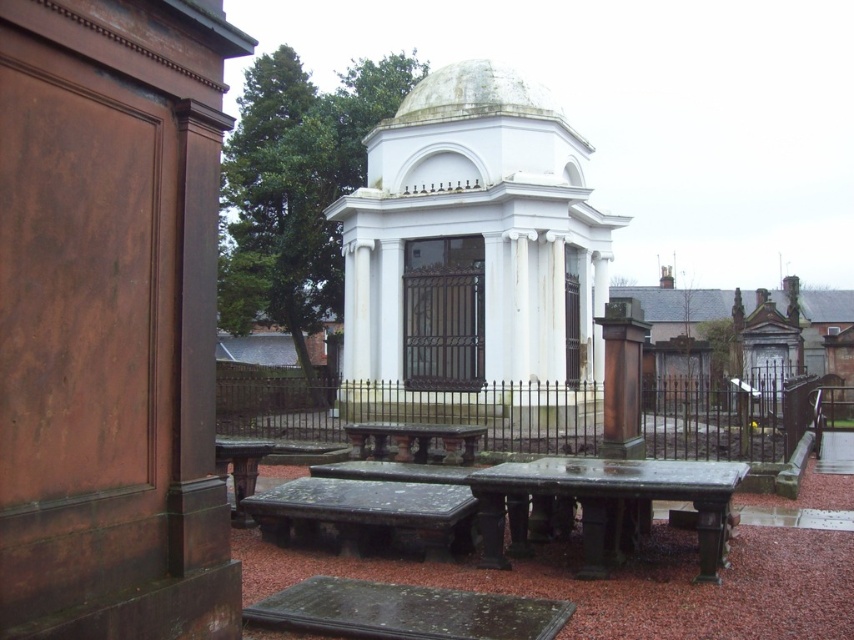
You are standing at the entrance of the cemetery and want to locate the white marble chapel at center. According to the coordinates provided, where should you look to find it?

The white marble chapel at center is located at the coordinates point (471, 252), so you should look towards the central area slightly towards the lower half of the scene to find it.

You are a visitor at the cemetery and want to take a photo of both the white marble chapel at center and the polished stone table at center from a single angle. Which object should you position closer to the camera to ensure both are fully visible in the frame?

The polished stone table at center should be positioned closer to the camera since the white marble chapel at center is taller. By placing the shorter polished stone table at center nearer to the camera, both objects can be accommodated within the frame without one being cut off due to the height difference.